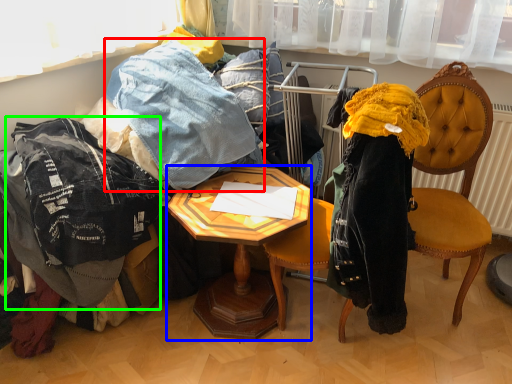
Question: Which object is positioned farthest from trousers (highlighted by a red box)? Select from desk (highlighted by a blue box) and clothing (highlighted by a green box).

Choices:
 (A) desk
 (B) clothing

Answer: (B)